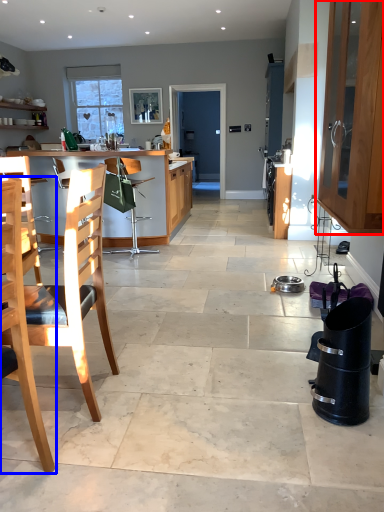
Question: Which of the following is the closest to the observer, cabinetry (highlighted by a red box) or chair (highlighted by a blue box)?

Choices:
 (A) cabinetry
 (B) chair

Answer: (B)